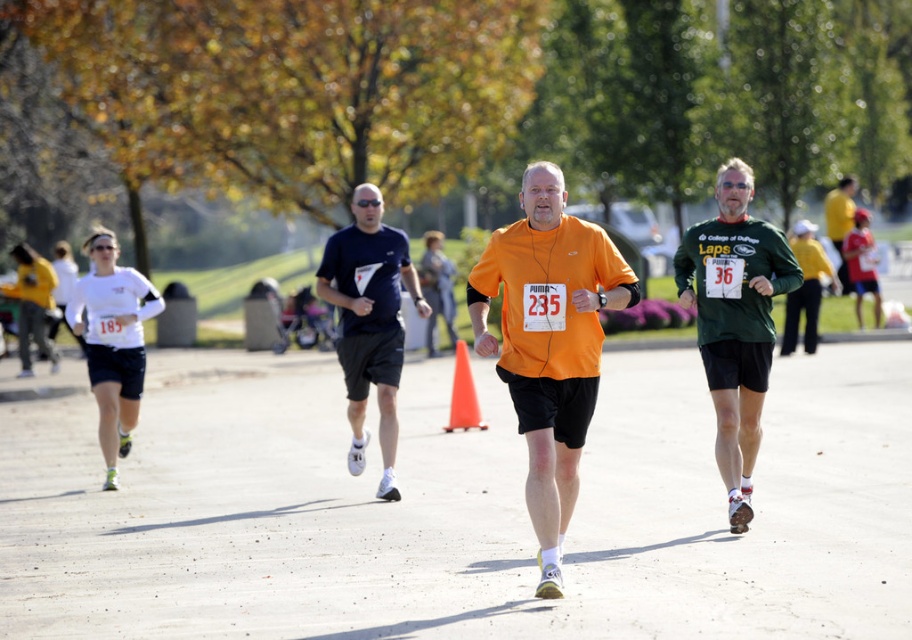
Can you confirm if smooth concrete road at center is bigger than green jersey at center?

Yes, smooth concrete road at center is bigger than green jersey at center.

Can you confirm if smooth concrete road at center is positioned below green jersey at center?

Yes.

Describe the element at coordinates (463, 512) in the screenshot. Image resolution: width=912 pixels, height=640 pixels. I see `smooth concrete road at center` at that location.

This screenshot has height=640, width=912. What are the coordinates of `smooth concrete road at center` in the screenshot? It's located at (463, 512).

Is orange matte shirt at center smaller than green jersey at center?

No.

The height and width of the screenshot is (640, 912). Identify the location of orange matte shirt at center. (548, 342).

Is smooth concrete road at center behind orange matte shirt at center?

No, it is not.

Is smooth concrete road at center bigger than orange matte shirt at center?

Indeed, smooth concrete road at center has a larger size compared to orange matte shirt at center.

At what (x,y) coordinates should I click in order to perform the action: click on smooth concrete road at center. Please return your answer as a coordinate pair (x, y). The image size is (912, 640). Looking at the image, I should click on (463, 512).